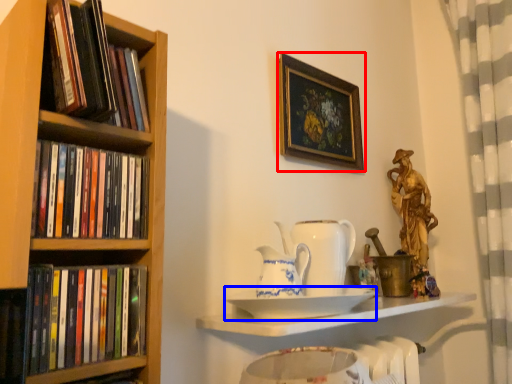
Question: Which object is further to the camera taking this photo, picture frame (highlighted by a red box) or plate (highlighted by a blue box)?

Choices:
 (A) picture frame
 (B) plate

Answer: (A)